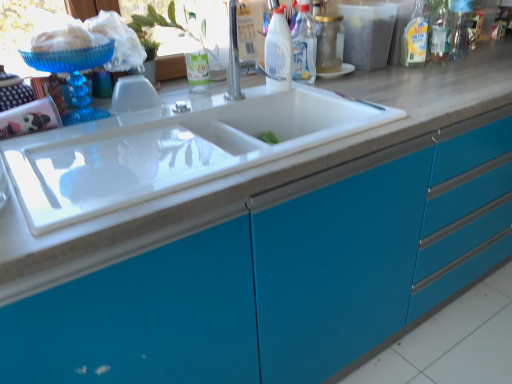
Identify the location of free space in front of white glossy bottle at upper center, the second bottle in the left-to-right sequence. (315, 92).